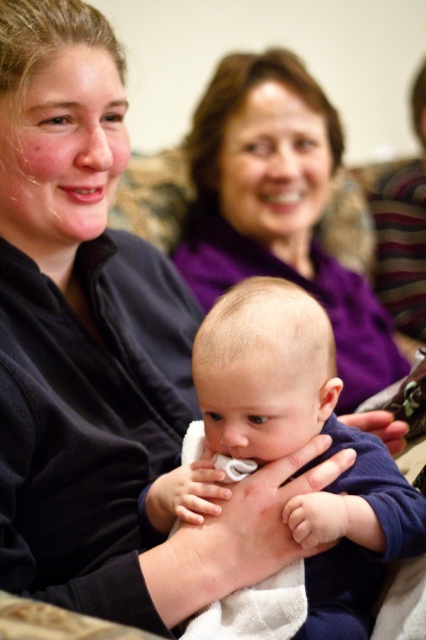
Question: Among these points, which one is nearest to the camera?

Choices:
 (A) (267, 316)
 (B) (209, 148)

Answer: (A)

Question: Observing the image, what is the correct spatial positioning of smooth blue shirt at center in reference to purple fabric at upper center?

Choices:
 (A) above
 (B) below

Answer: (B)

Question: Observing the image, what is the correct spatial positioning of smooth blue shirt at center in reference to purple fabric at upper center?

Choices:
 (A) right
 (B) left

Answer: (B)

Question: Is smooth blue shirt at center wider than purple fabric at upper center?

Choices:
 (A) yes
 (B) no

Answer: (B)